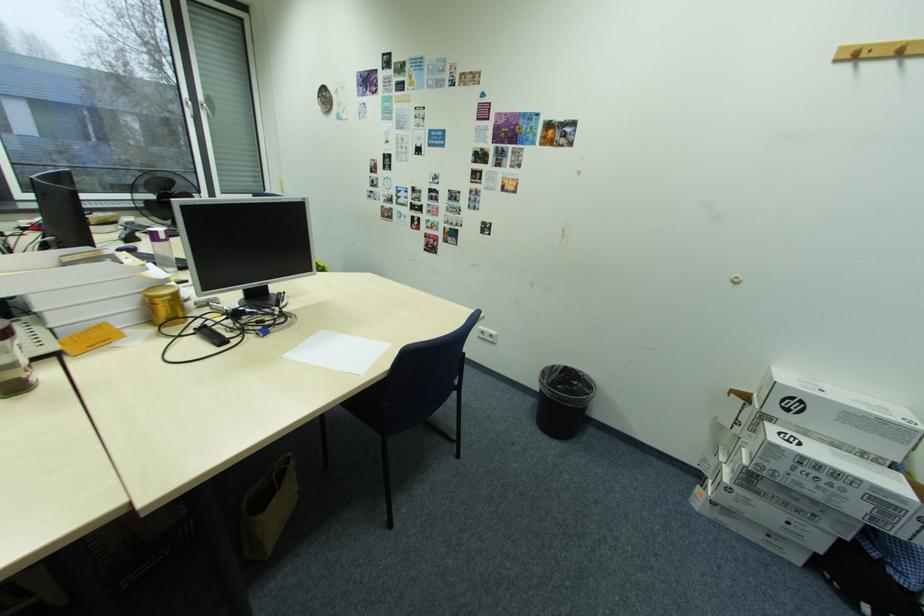
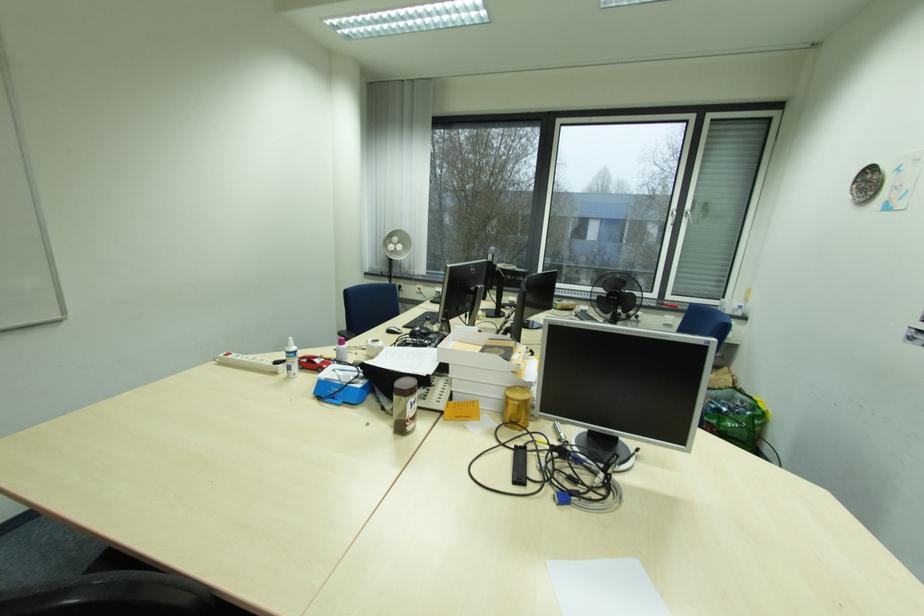
Question: The camera is either moving clockwise (left) or counter-clockwise (right) around the object. The first image is from the beginning of the video and the second image is from the end. Is the camera moving left or right when shooting the video?

Choices:
 (A) Left
 (B) Right

Answer: (B)